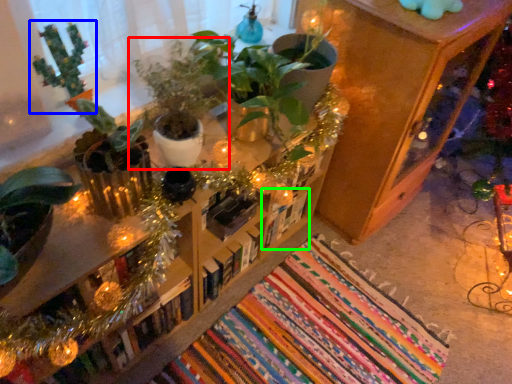
Question: Considering the real-world distances, which object is farthest from houseplant (highlighted by a red box)? houseplant (highlighted by a blue box) or book (highlighted by a green box)?

Choices:
 (A) houseplant
 (B) book

Answer: (B)